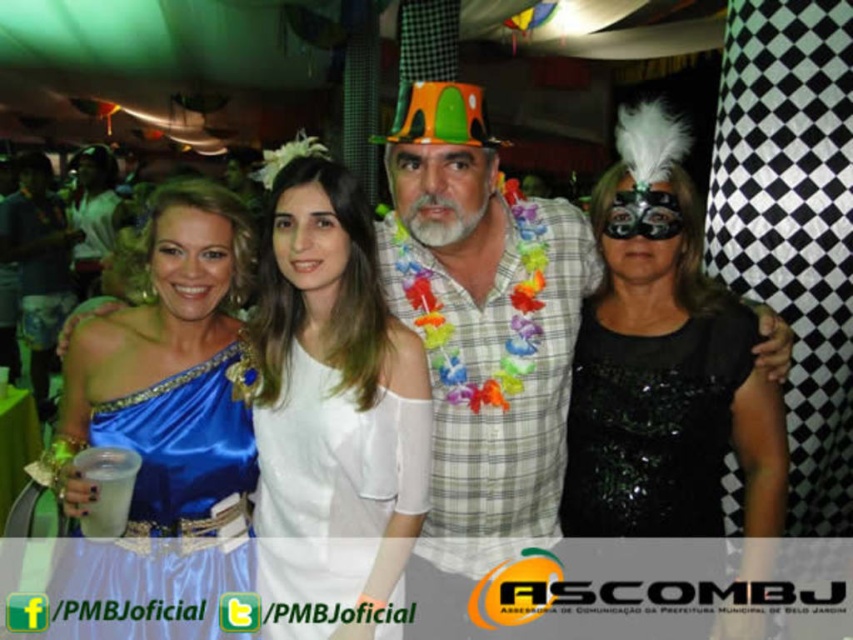
Is black sequined mask at right to the right of blue satin dress at left from the viewer's perspective?

Correct, you'll find black sequined mask at right to the right of blue satin dress at left.

In the scene shown: Is black sequined mask at right below blue satin dress at left?

Actually, black sequined mask at right is above blue satin dress at left.

Is point (637, 531) less distant than point (219, 563)?

That is False.

Locate an element on the screen. The height and width of the screenshot is (640, 853). black sequined mask at right is located at coordinates (664, 362).

Who is more distant from viewer, (582, 500) or (683, 378)?

Positioned behind is point (582, 500).

Can you confirm if black sequined mask at right is positioned above black sequined dress at right?

Yes, black sequined mask at right is above black sequined dress at right.

You are a GUI agent. You are given a task and a screenshot of the screen. Output one action in this format:
    pyautogui.click(x=<x>, y=<y>)
    Task: Click on the black sequined mask at right
    
    Given the screenshot: What is the action you would take?
    pyautogui.click(x=664, y=362)

The width and height of the screenshot is (853, 640). What do you see at coordinates (664, 362) in the screenshot?
I see `black sequined mask at right` at bounding box center [664, 362].

You are a GUI agent. You are given a task and a screenshot of the screen. Output one action in this format:
    pyautogui.click(x=<x>, y=<y>)
    Task: Click on the black sequined mask at right
    The image size is (853, 640).
    Given the screenshot: What is the action you would take?
    pyautogui.click(x=664, y=362)

Where is `black sequined mask at right`? black sequined mask at right is located at coordinates (664, 362).